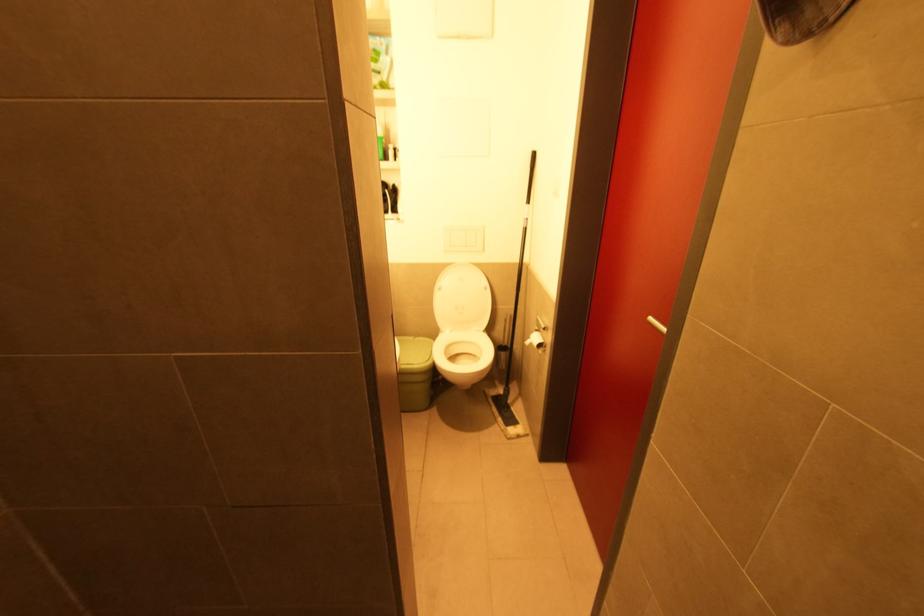
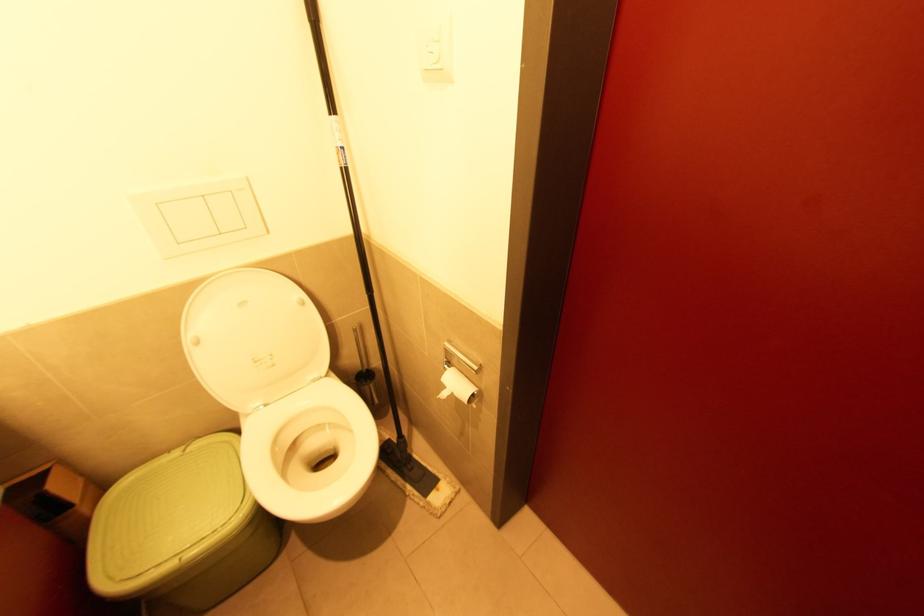
The point at (441, 290) is marked in the first image. Where is the corresponding point in the second image?

(200, 342)